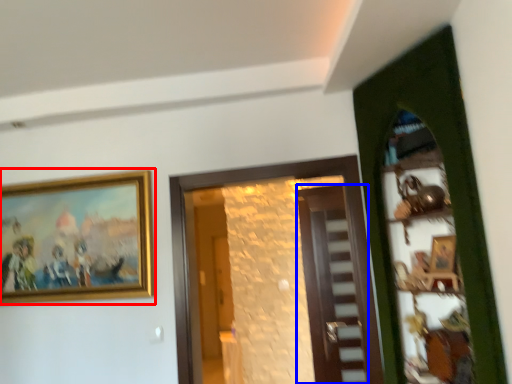
Question: Among these objects, which one is nearest to the camera, picture frame (highlighted by a red box) or door (highlighted by a blue box)?

Choices:
 (A) picture frame
 (B) door

Answer: (A)